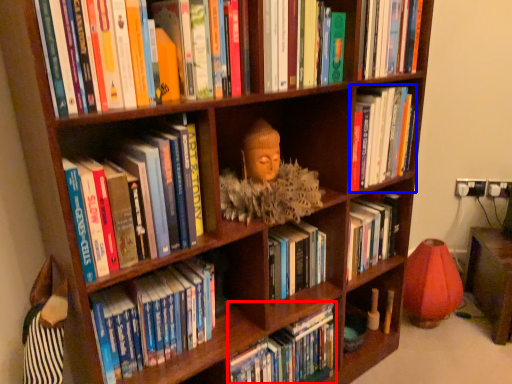
Question: Which point is further to the camera, book (highlighted by a red box) or book (highlighted by a blue box)?

Choices:
 (A) book
 (B) book

Answer: (B)